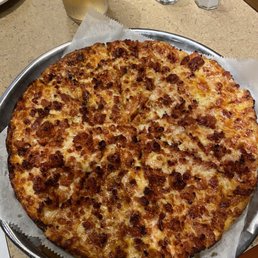
The width and height of the screenshot is (258, 258). I want to click on grease spot, so click(x=19, y=216), click(x=214, y=254).